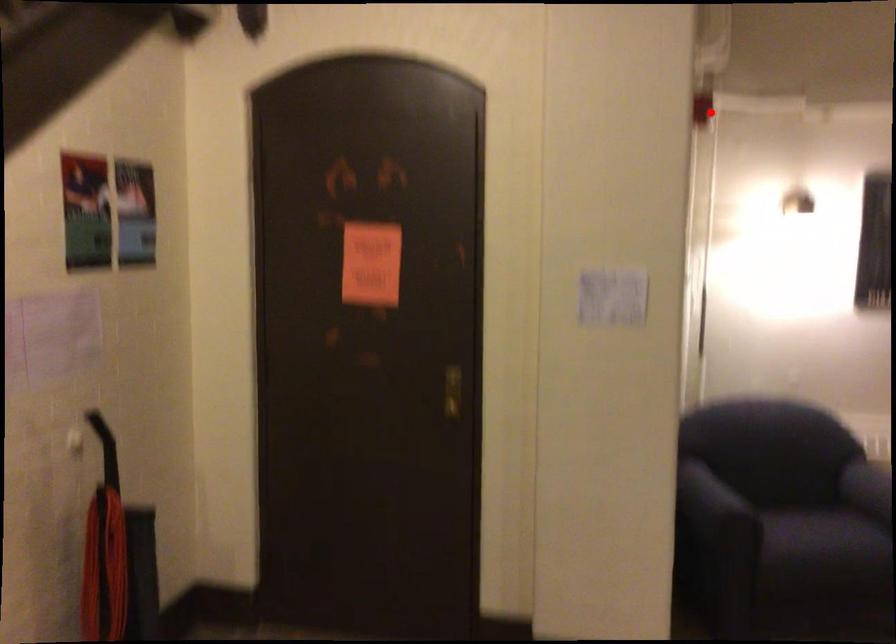
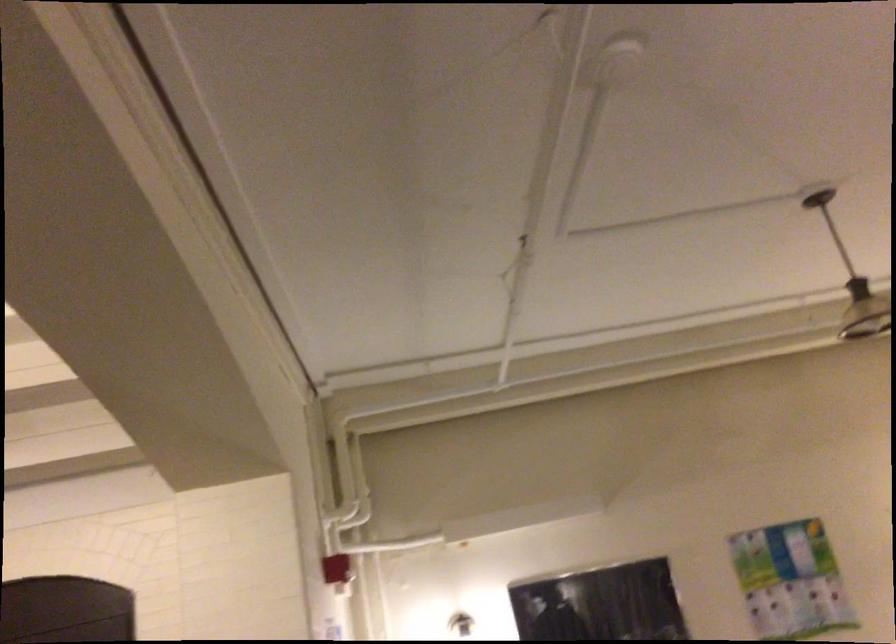
Question: A red point is marked in image1. In image2, is the corresponding 3D point closer to the camera or farther? Reply with the corresponding letter.

Choices:
 (A) The corresponding 3D point is closer.
 (B) The corresponding 3D point is farther.

Answer: (B)